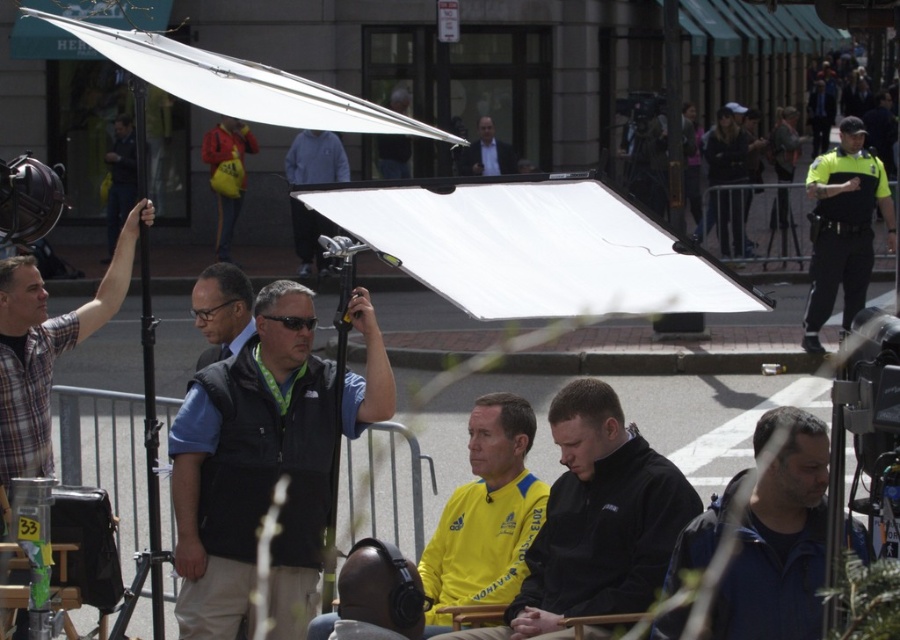
Can you confirm if light blue fabric at center is taller than matte black suit at center?

Incorrect, light blue fabric at center's height is not larger of matte black suit at center's.

Is point (303, 205) positioned after point (490, 172)?

No, (303, 205) is in front of (490, 172).

The image size is (900, 640). I want to click on light blue fabric at center, so click(315, 157).

Does point (29, 412) come farther from viewer compared to point (349, 548)?

That is False.

Does plaid shirt at left lie in front of black matte headphones at center?

No, it is not.

Locate an element on the screen. This screenshot has width=900, height=640. plaid shirt at left is located at coordinates (47, 346).

Identify the location of plaid shirt at left. (47, 346).

Who is higher up, yellow fabric shirt at center or dark blue jacket at lower right?

dark blue jacket at lower right

Where is `yellow fabric shirt at center`? yellow fabric shirt at center is located at coordinates (596, 520).